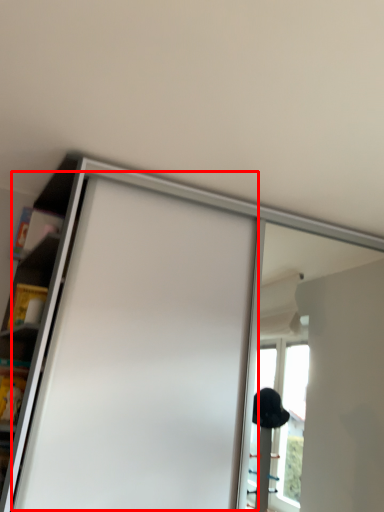
Question: From the image's perspective, what is the correct spatial positioning of screen door (annotated by the red box) in reference to shelf?

Choices:
 (A) below
 (B) above

Answer: (A)